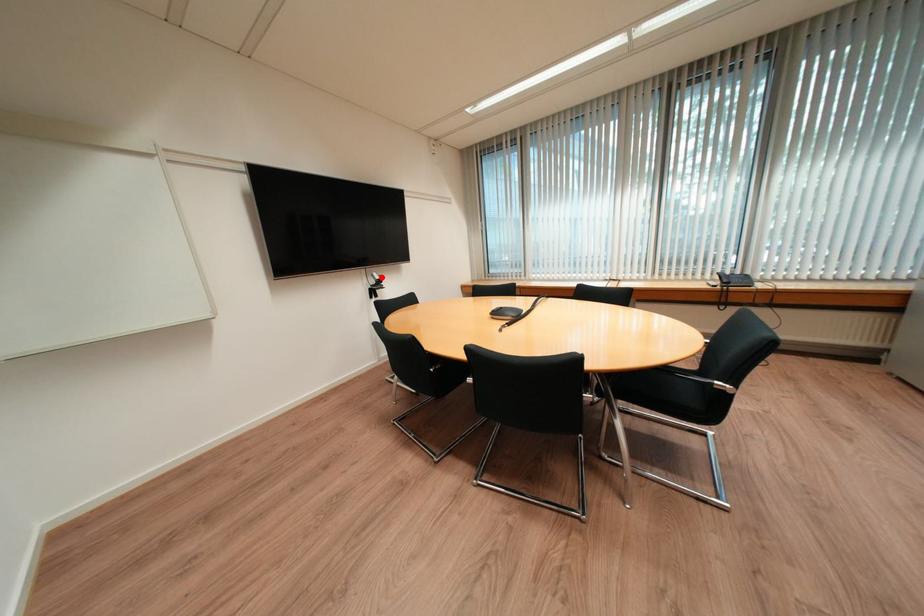
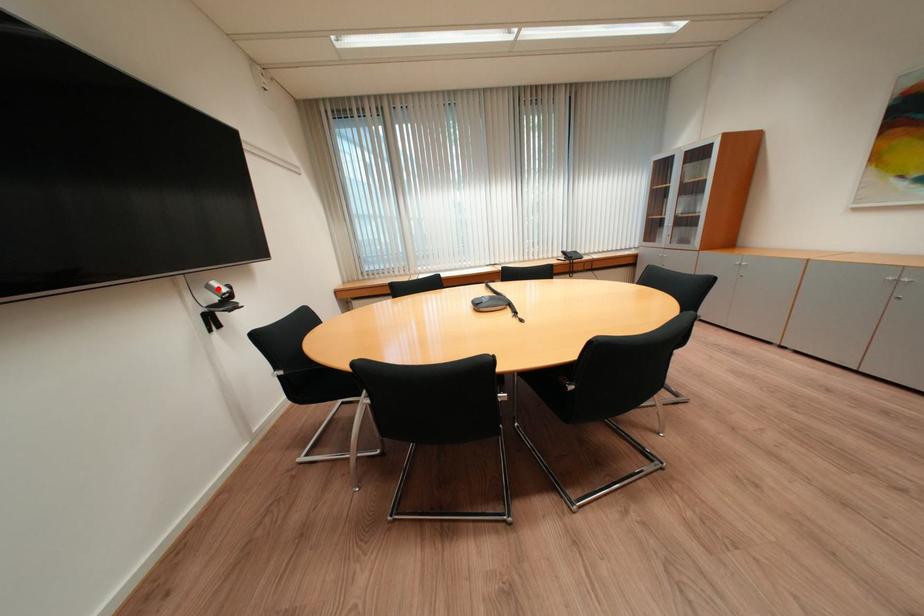
I am providing you with two images of the same scene from different viewpoints. A red point is marked on the first image and another point is marked on the second image. Does the point marked in image1 correspond to the same location as the one in image2?

Yes